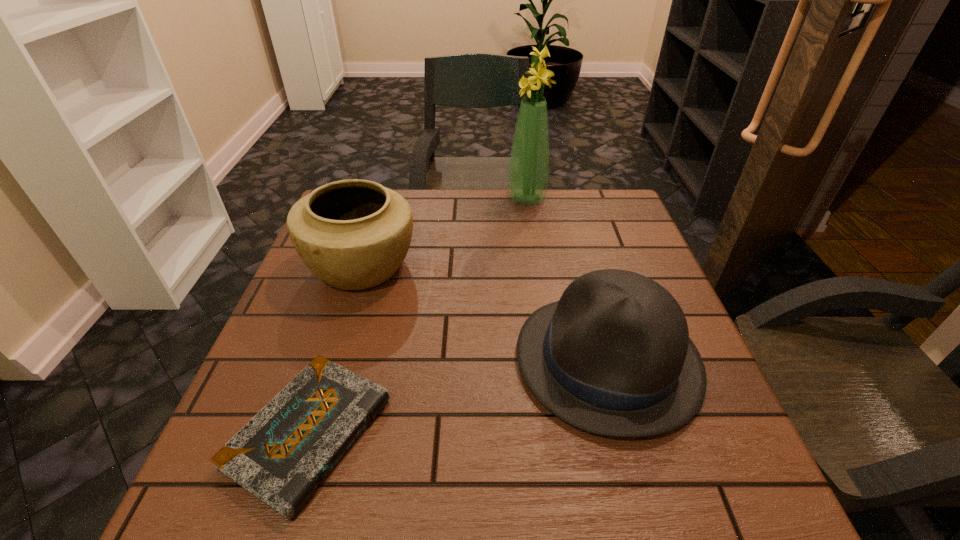
You are a GUI agent. You are given a task and a screenshot of the screen. Output one action in this format:
    pyautogui.click(x=<x>, y=<y>)
    Task: Click on the free point located on the front-facing side of the bowler hat
    
    Given the screenshot: What is the action you would take?
    pyautogui.click(x=491, y=359)

Where is `free space located on the front-facing side of the bowler hat`? The width and height of the screenshot is (960, 540). free space located on the front-facing side of the bowler hat is located at coordinates (424, 359).

Find the location of a particular element. This screenshot has width=960, height=540. vacant space located on the right of the shortest object is located at coordinates (611, 433).

Where is `bouquet located at the far edge`? The image size is (960, 540). bouquet located at the far edge is located at coordinates (528, 172).

You are a GUI agent. You are given a task and a screenshot of the screen. Output one action in this format:
    pyautogui.click(x=<x>, y=<y>)
    Task: Click on the pottery at the far edge
    The height and width of the screenshot is (540, 960).
    Given the screenshot: What is the action you would take?
    pyautogui.click(x=354, y=234)

Find the location of a particular element. object that is at the near edge is located at coordinates (283, 453).

Locate an element on the screen. Image resolution: width=960 pixels, height=540 pixels. pottery situated at the left edge is located at coordinates (354, 234).

At what (x,y) coordinates should I click in order to perform the action: click on notebook located at the left edge. Please return your answer as a coordinate pair (x, y). This screenshot has height=540, width=960. Looking at the image, I should click on (283, 453).

Where is `object at the right edge`? The image size is (960, 540). object at the right edge is located at coordinates (613, 357).

Locate an element on the screen. The width and height of the screenshot is (960, 540). object that is positioned at the far left corner is located at coordinates (354, 234).